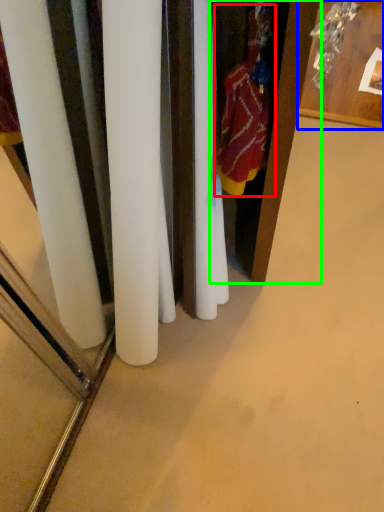
Question: Which object is the closest to the clothing (highlighted by a red box)? Choose among these: furniture (highlighted by a blue box) or armoire (highlighted by a green box).

Choices:
 (A) furniture
 (B) armoire

Answer: (B)